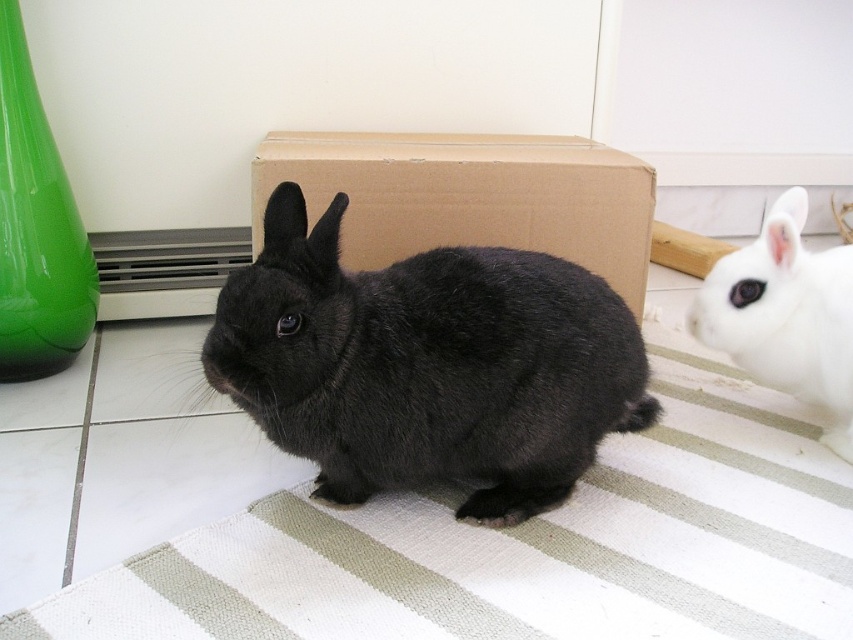
Question: Which of the following is the farthest from the observer?

Choices:
 (A) (801, 262)
 (B) (25, 618)

Answer: (A)

Question: Where is white textured mat at center located in relation to cardboard box at center in the image?

Choices:
 (A) above
 (B) below

Answer: (B)

Question: Is white textured mat at center below cardboard box at center?

Choices:
 (A) yes
 (B) no

Answer: (A)

Question: Which object is the closest to the white textured mat at center?

Choices:
 (A) white fluffy rabbit at lower right
 (B) cardboard box at center
 (C) black furry rabbit at center

Answer: (C)

Question: Which is nearer to the cardboard box at center?

Choices:
 (A) white fluffy rabbit at lower right
 (B) black furry rabbit at center

Answer: (A)

Question: Is black furry rabbit at center further to the viewer compared to cardboard box at center?

Choices:
 (A) no
 (B) yes

Answer: (A)